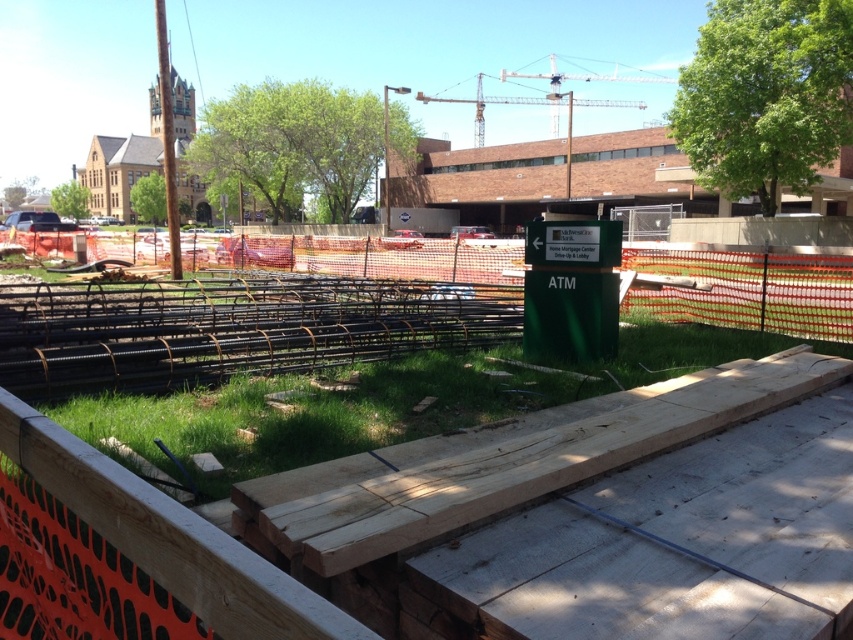
The height and width of the screenshot is (640, 853). Describe the element at coordinates (334, 512) in the screenshot. I see `green wood construction at center` at that location.

In the scene shown: Who is more forward, (49,561) or (408,278)?

Point (49,561) is in front.

The width and height of the screenshot is (853, 640). I want to click on green wood construction at center, so click(x=334, y=512).

Is green grass at center positioned in front of orange mesh fence at center?

Yes.

Who is taller, green grass at center or orange mesh fence at center?

Standing taller between the two is orange mesh fence at center.

Is point (309, 442) less distant than point (254, 260)?

Yes, point (309, 442) is closer to viewer.

Where is `green grass at center`? The image size is (853, 640). green grass at center is located at coordinates (386, 401).

Who is positioned more to the right, green wood construction at center or green grass at center?

From the viewer's perspective, green wood construction at center appears more on the right side.

Is point (67, 522) positioned behind point (798, 340)?

That is False.

I want to click on green wood construction at center, so click(334, 512).